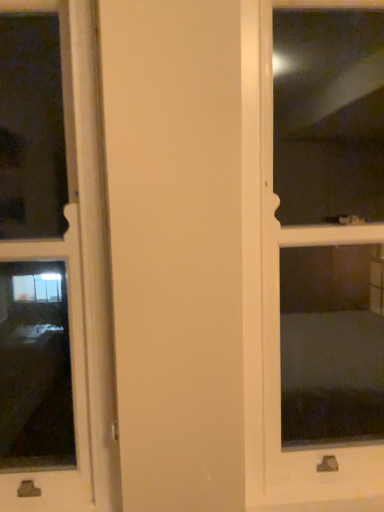
Locate an element on the screen. The height and width of the screenshot is (512, 384). transparent glass screen door at right is located at coordinates (278, 293).

What do you see at coordinates (278, 293) in the screenshot? This screenshot has width=384, height=512. I see `transparent glass screen door at right` at bounding box center [278, 293].

Locate an element on the screen. This screenshot has width=384, height=512. transparent glass screen door at right is located at coordinates (278, 293).